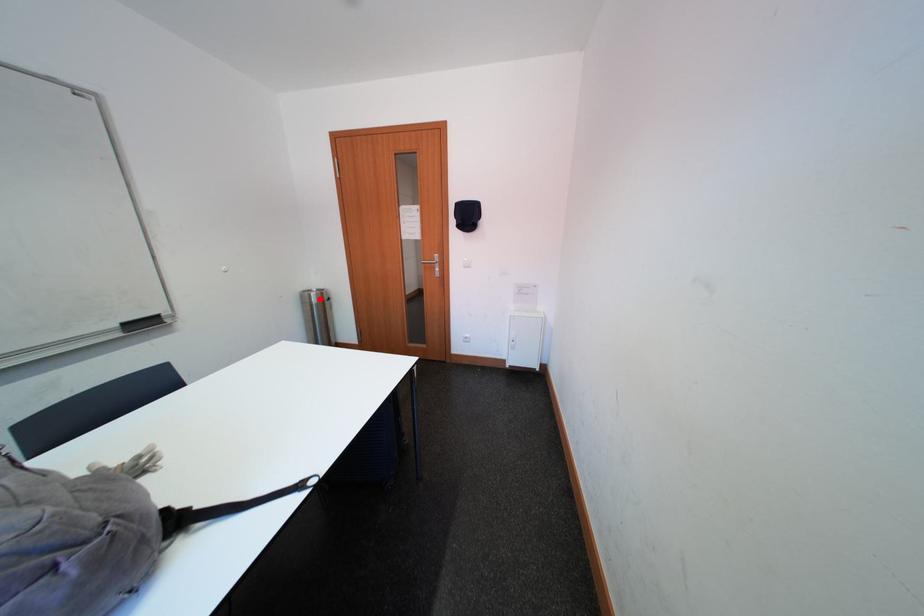
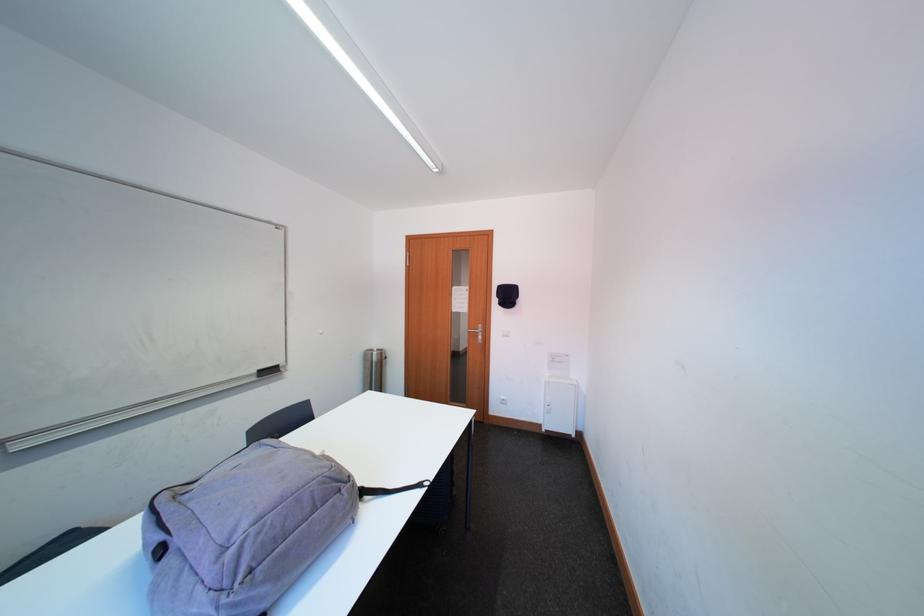
Where in the second image is the point corresponding to the highlighted location from the first image?

(382, 358)